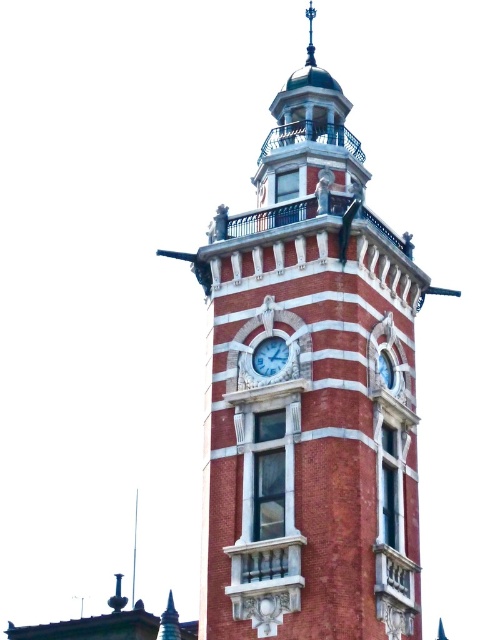
Question: Can you confirm if red brick clock tower at center is thinner than white marble clock at center?

Choices:
 (A) no
 (B) yes

Answer: (A)

Question: Is the position of red brick clock tower at center more distant than that of white marble clock at center?

Choices:
 (A) yes
 (B) no

Answer: (B)

Question: Is the position of red brick clock tower at center more distant than that of white marble clock at center?

Choices:
 (A) no
 (B) yes

Answer: (A)

Question: Which point appears farthest from the camera in this image?

Choices:
 (A) (365, 305)
 (B) (277, 346)

Answer: (A)

Question: Which object is farther from the camera taking this photo?

Choices:
 (A) red brick clock tower at center
 (B) white marble clock at center

Answer: (B)